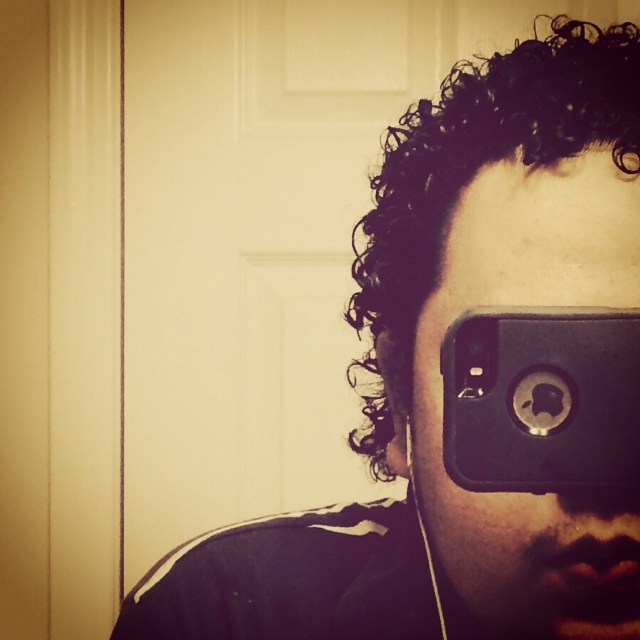
Does point (502, 248) lie in front of point (493, 461)?

No, (502, 248) is behind (493, 461).

Who is higher up, black matte phone at center or black rubberized phone at center?

Positioned higher is black matte phone at center.

Where is `black matte phone at center`? This screenshot has height=640, width=640. black matte phone at center is located at coordinates (518, 305).